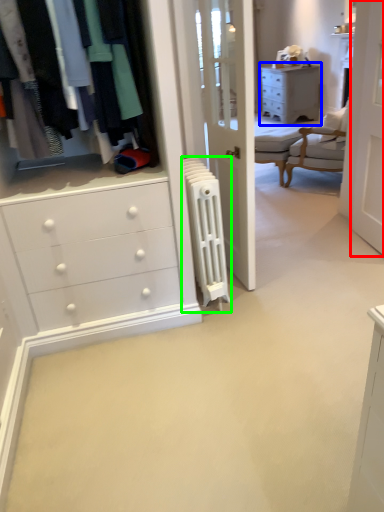
Question: Which is farther away from screen door (highlighted by a red box)? chest of drawers (highlighted by a blue box) or radiator (highlighted by a green box)?

Choices:
 (A) chest of drawers
 (B) radiator

Answer: (A)